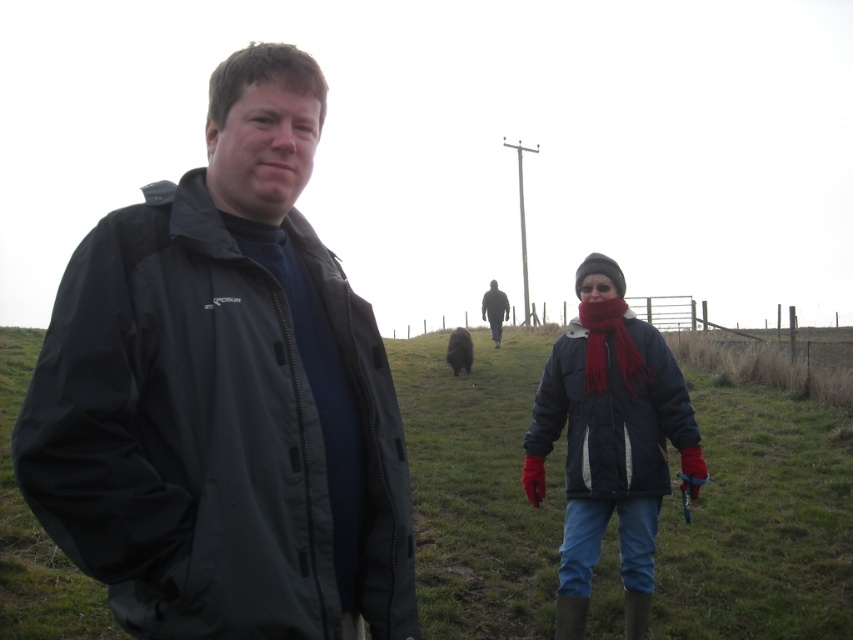
You are trying to identify two people in the scene. You see a maroon knitted scarf at center and a dark gray jacket at center. Which one is more to the left?

The maroon knitted scarf at center is more to the left than the dark gray jacket at center.